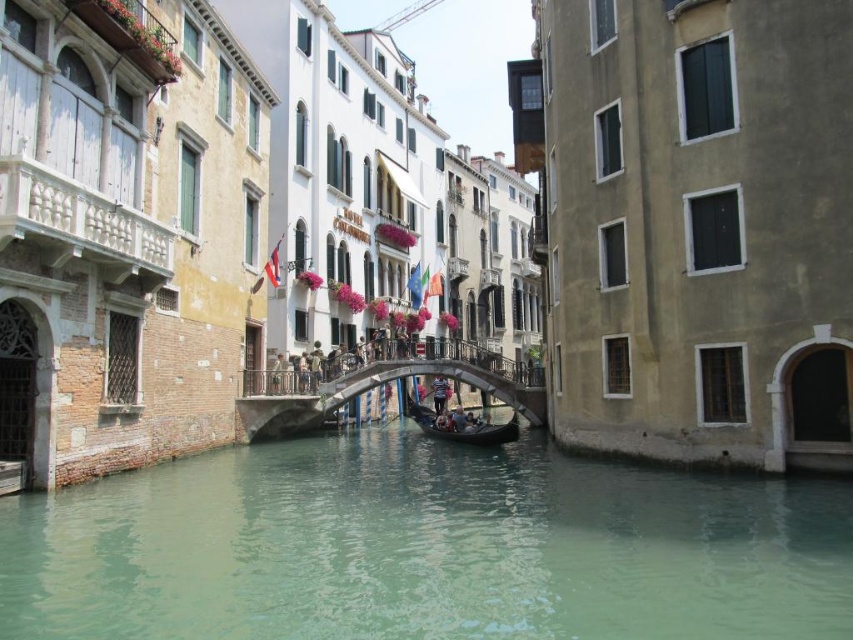
Is stone bridge at center to the left of light pink fabric at center from the viewer's perspective?

Yes, stone bridge at center is to the left of light pink fabric at center.

From the picture: Is stone bridge at center positioned behind light pink fabric at center?

No, stone bridge at center is in front of light pink fabric at center.

The image size is (853, 640). Describe the element at coordinates (378, 385) in the screenshot. I see `stone bridge at center` at that location.

Identify the location of stone bridge at center. (378, 385).

The height and width of the screenshot is (640, 853). What are the coordinates of `wooden gondola at center` in the screenshot? It's located at (463, 426).

Between wooden gondola at center and light pink fabric at center, which one has less height?

Standing shorter between the two is wooden gondola at center.

Does point (454, 422) lie behind point (440, 376)?

No, (454, 422) is closer to viewer.

What are the coordinates of `wooden gondola at center` in the screenshot? It's located at (463, 426).

Who is shorter, green water at center or wooden gondola at center?

green water at center is shorter.

Does green water at center appear under wooden gondola at center?

Yes, green water at center is below wooden gondola at center.

Locate an element on the screen. This screenshot has width=853, height=640. green water at center is located at coordinates (425, 548).